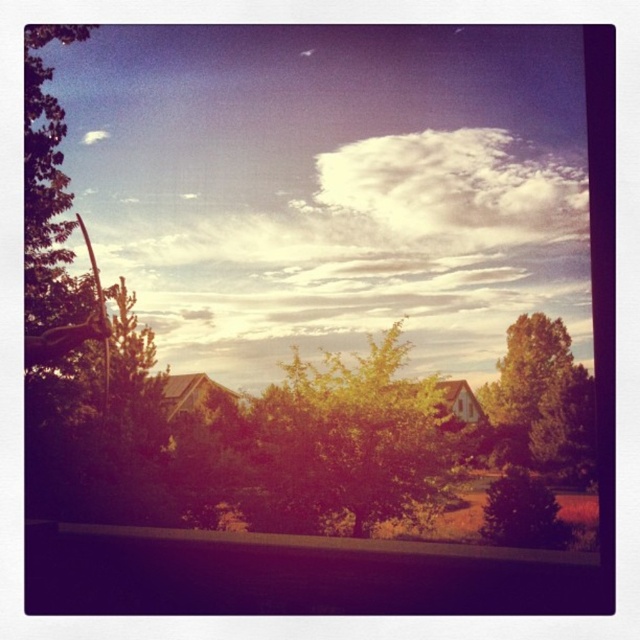
Question: Considering the relative positions of green leafy tree at right and green matte tree at lower right in the image provided, where is green leafy tree at right located with respect to green matte tree at lower right?

Choices:
 (A) above
 (B) below

Answer: (A)

Question: Does green leafy tree at right appear on the left side of green matte tree at lower right?

Choices:
 (A) yes
 (B) no

Answer: (B)

Question: Which point appears farthest from the camera in this image?

Choices:
 (A) (531, 387)
 (B) (282, 486)
 (C) (385, 221)
 (D) (540, 540)

Answer: (C)

Question: Which object is closer to the camera taking this photo?

Choices:
 (A) green matte tree at lower right
 (B) green leafy tree at right
 (C) green leafy tree at center
 (D) white fluffy cloud at upper center

Answer: (C)

Question: Can you confirm if white fluffy cloud at upper center is bigger than green leafy tree at right?

Choices:
 (A) yes
 (B) no

Answer: (B)

Question: Which point appears farthest from the camera in this image?

Choices:
 (A) (396, 412)
 (B) (499, 444)

Answer: (B)